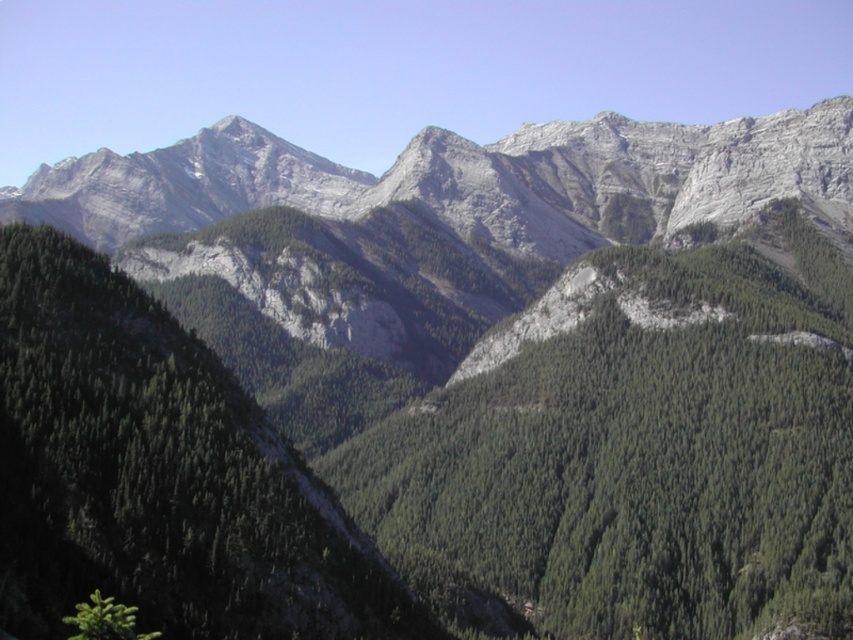
Who is more forward, (201, 221) or (132, 611)?

Point (132, 611) is more forward.

Can you confirm if gray rocky mountain range at center is positioned to the right of green matte tree at lower left?

Incorrect, gray rocky mountain range at center is not on the right side of green matte tree at lower left.

Is point (766, 168) positioned behind point (78, 608)?

Yes.

The image size is (853, 640). I want to click on gray rocky mountain range at center, so click(x=469, y=180).